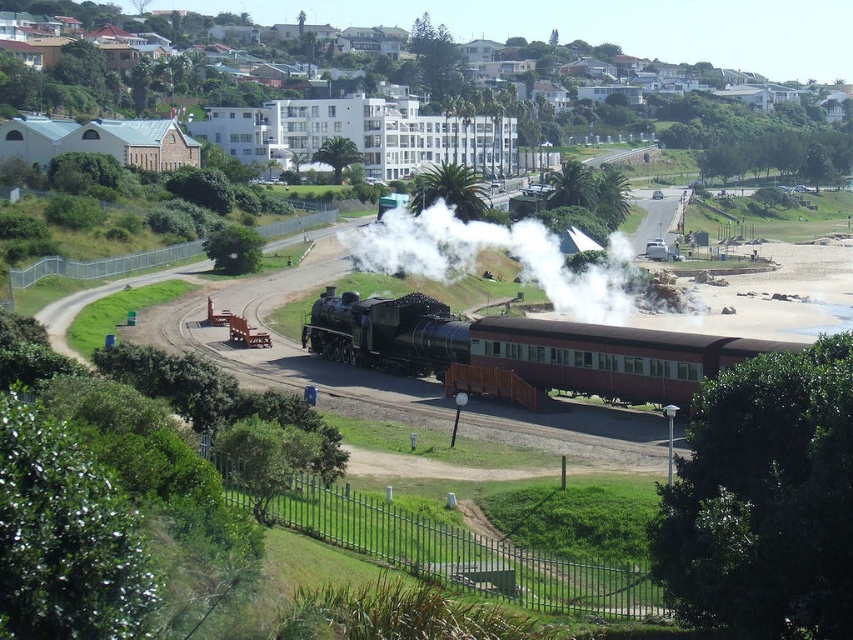
You are a photographer positioned at the edge of the railway track, aiming to capture the matte black train at center and white smoke at center in your shot. Based on their positions, which object should you adjust your camera focus on first if you want to ensure both are in focus?

The matte black train at center is to the left of white smoke at center. Since the train is closer to the photographer, you should focus on the matte black train at center first to ensure both are in focus.

You are standing at the point where the metal fence starts. You want to take a photo of the white smooth building at upper center. In which direction should you point your camera relative to the metal fence?

The white smooth building at upper center is located at coordinates point (x=393, y=120), so you should point your camera towards the upper center direction relative to the metal fence.

You are a photographer positioned at the side of the railway track. You want to capture the shiny black locomotive at center and the white smoke at center in your shot. Which object appears taller in the photo?

The white smoke at center appears taller in the photo than the shiny black locomotive at center because the white smoke at center has a greater height compared to shiny black locomotive at center.